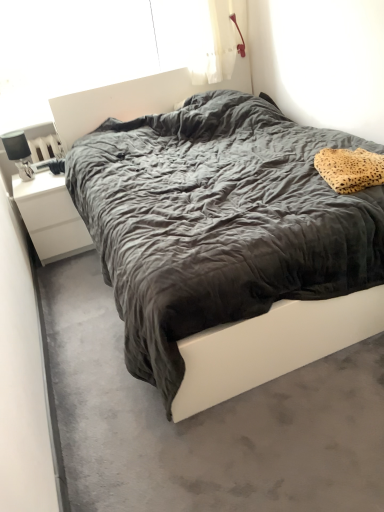
In order to face leopard print fabric pillow at upper right, should I rotate leftwards or rightwards?

A 21.551 degree turn to the right will do.

In order to face matte black lamp at left, should I rotate leftwards or rightwards?

To face it directly, rotate left by 22.092 degrees.

Image resolution: width=384 pixels, height=512 pixels. I want to click on dark gray fabric bed at center, so click(205, 421).

Locate an element on the screen. This screenshot has width=384, height=512. white matte nightstand at left is located at coordinates (51, 217).

Image resolution: width=384 pixels, height=512 pixels. Identify the location of velvet dark gray bed at center. (272, 346).

What do you see at coordinates (272, 346) in the screenshot? Image resolution: width=384 pixels, height=512 pixels. I see `velvet dark gray bed at center` at bounding box center [272, 346].

Where is `leopard print fabric pillow at upper right`? This screenshot has height=512, width=384. leopard print fabric pillow at upper right is located at coordinates (350, 169).

How many degrees apart are the facing directions of matte black lamp at left and white matte nightstand at left?

The angular difference between matte black lamp at left and white matte nightstand at left is 0.843 degrees.

Is matte black lamp at left turned away from white matte nightstand at left?

matte black lamp at left does not have its back to white matte nightstand at left.

Where is `lamp above the white matte nightstand at left (from the image's perspective)`? lamp above the white matte nightstand at left (from the image's perspective) is located at coordinates (18, 153).

Considering the relative sizes of matte black lamp at left and white matte nightstand at left in the image provided, is matte black lamp at left smaller than white matte nightstand at left?

Indeed, matte black lamp at left has a smaller size compared to white matte nightstand at left.

In the scene shown: Based on their sizes in the image, would you say matte black lamp at left is bigger or smaller than leopard print fabric pillow at upper right?

matte black lamp at left is smaller than leopard print fabric pillow at upper right.

Looking at this image, which is more to the right, matte black lamp at left or leopard print fabric pillow at upper right?

leopard print fabric pillow at upper right is more to the right.

Which of these two, matte black lamp at left or leopard print fabric pillow at upper right, stands taller?

With more height is matte black lamp at left.

Which is closer, (91, 12) or (29, 177)?

The point (29, 177) is in front.

Considering the positions of objects transparent plastic window screen at upper center and matte black lamp at left in the image provided, who is more to the right, transparent plastic window screen at upper center or matte black lamp at left?

transparent plastic window screen at upper center.

Are transparent plastic window screen at upper center and matte black lamp at left beside each other?

transparent plastic window screen at upper center is not next to matte black lamp at left, and they're not touching.

From a real-world perspective, which object rests below the other?

In real-world perspective, velvet dark gray bed at center is lower.

From the image's perspective, which is above, velvet dark gray bed at center or transparent plastic window screen at upper center?

transparent plastic window screen at upper center.

Measure the distance between velvet dark gray bed at center and transparent plastic window screen at upper center.

velvet dark gray bed at center and transparent plastic window screen at upper center are 2.54 meters apart.

Does point (276, 304) come farther from viewer compared to point (76, 21)?

No.

Between leopard print fabric pillow at upper right and dark gray fabric bed at center, which one has larger width?

With larger width is dark gray fabric bed at center.

From a real-world perspective, is leopard print fabric pillow at upper right below dark gray fabric bed at center?

No, from a real-world perspective, leopard print fabric pillow at upper right is not below dark gray fabric bed at center.

Between leopard print fabric pillow at upper right and dark gray fabric bed at center, which one has less height?

dark gray fabric bed at center.

Is there a large distance between leopard print fabric pillow at upper right and dark gray fabric bed at center?

leopard print fabric pillow at upper right is far away from dark gray fabric bed at center.

Which of these two, transparent plastic window screen at upper center or white matte nightstand at left, is thinner?

transparent plastic window screen at upper center is thinner.

Measure the distance from transparent plastic window screen at upper center to white matte nightstand at left.

transparent plastic window screen at upper center is 3.36 feet from white matte nightstand at left.

Is transparent plastic window screen at upper center facing away from white matte nightstand at left?

No, transparent plastic window screen at upper center is not facing away from white matte nightstand at left.

Find the location of a particular element. The height and width of the screenshot is (512, 384). nightstand beneath the transparent plastic window screen at upper center (from a real-world perspective) is located at coordinates (51, 217).

From a real-world perspective, is dark gray fabric bed at center positioned under transparent plastic window screen at upper center based on gravity?

Correct, in the physical world, dark gray fabric bed at center is lower than transparent plastic window screen at upper center.

Is dark gray fabric bed at center wider or thinner than transparent plastic window screen at upper center?

In the image, dark gray fabric bed at center appears to be wider than transparent plastic window screen at upper center.

Can you confirm if dark gray fabric bed at center is bigger than transparent plastic window screen at upper center?

No, dark gray fabric bed at center is not bigger than transparent plastic window screen at upper center.

You are a GUI agent. You are given a task and a screenshot of the screen. Output one action in this format:
    pyautogui.click(x=<x>, y=<y>)
    Task: Click on the concrete below the transparent plastic window screen at upper center (from a real-world perspective)
    
    Given the screenshot: What is the action you would take?
    click(205, 421)

The width and height of the screenshot is (384, 512). I want to click on lamp positioned vertically above the white matte nightstand at left (from a real-world perspective), so click(18, 153).

Where is `pillow lying in front of the matte black lamp at left`? This screenshot has width=384, height=512. pillow lying in front of the matte black lamp at left is located at coordinates (350, 169).

From the image, which object appears to be farther from transparent plastic window screen at upper center, white matte nightstand at left or velvet dark gray bed at center?

velvet dark gray bed at center is further to transparent plastic window screen at upper center.

When comparing their distances from velvet dark gray bed at center, does leopard print fabric pillow at upper right or white matte nightstand at left seem closer?

The object closer to velvet dark gray bed at center is leopard print fabric pillow at upper right.

Looking at this image, which object lies further to the anchor point leopard print fabric pillow at upper right, dark gray fabric bed at center or matte black lamp at left?

matte black lamp at left.

Which object lies further to the anchor point white matte nightstand at left, transparent plastic window screen at upper center or velvet dark gray bed at center?

The object further to white matte nightstand at left is velvet dark gray bed at center.

When comparing their distances from transparent plastic window screen at upper center, does velvet dark gray bed at center or matte black lamp at left seem closer?

Among the two, matte black lamp at left is located nearer to transparent plastic window screen at upper center.

Looking at the image, which one is located further to dark gray fabric bed at center, velvet dark gray bed at center or white matte nightstand at left?

Based on the image, white matte nightstand at left appears to be further to dark gray fabric bed at center.

From the image, which object appears to be farther from transparent plastic window screen at upper center, white matte nightstand at left or leopard print fabric pillow at upper right?

The object further to transparent plastic window screen at upper center is leopard print fabric pillow at upper right.

Estimate the real-world distances between objects in this image. Which object is further from velvet dark gray bed at center, matte black lamp at left or leopard print fabric pillow at upper right?

matte black lamp at left.

Where is `bed located between white matte nightstand at left and leopard print fabric pillow at upper right in the left-right direction`? This screenshot has height=512, width=384. bed located between white matte nightstand at left and leopard print fabric pillow at upper right in the left-right direction is located at coordinates (272, 346).

Where is `window screen between matte black lamp at left and leopard print fabric pillow at upper right`? The width and height of the screenshot is (384, 512). window screen between matte black lamp at left and leopard print fabric pillow at upper right is located at coordinates (95, 42).

The height and width of the screenshot is (512, 384). Identify the location of bed located between dark gray fabric bed at center and leopard print fabric pillow at upper right in the left-right direction. (272, 346).

Find the location of a particular element. concrete located between white matte nightstand at left and leopard print fabric pillow at upper right in the left-right direction is located at coordinates (205, 421).